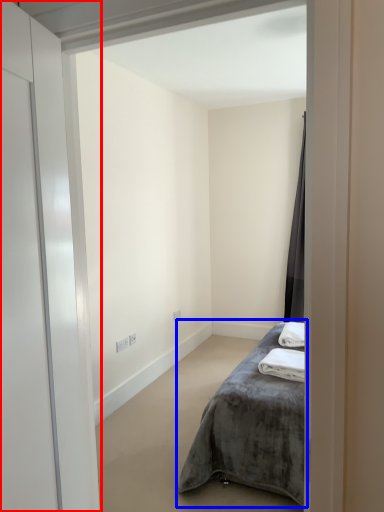
Question: Which object is further to the camera taking this photo, door (highlighted by a red box) or bed (highlighted by a blue box)?

Choices:
 (A) door
 (B) bed

Answer: (B)